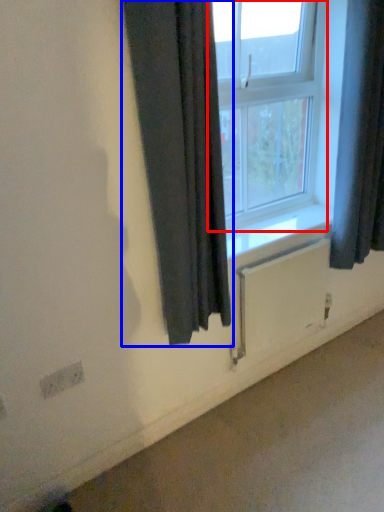
Question: Which object is further to the camera taking this photo, window (highlighted by a red box) or curtain (highlighted by a blue box)?

Choices:
 (A) window
 (B) curtain

Answer: (A)